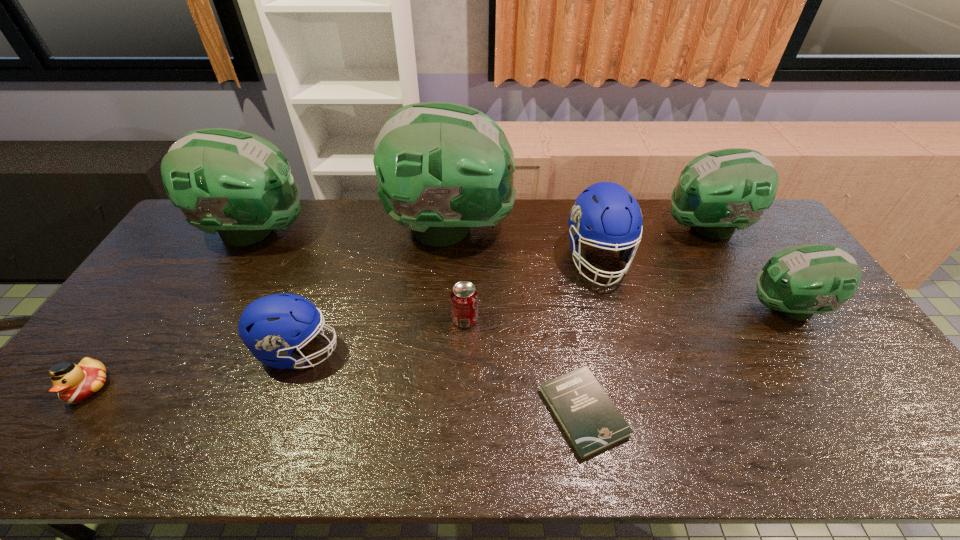
Identify the location of soda can. The image size is (960, 540). (464, 296).

Identify the location of red duck. This screenshot has width=960, height=540. (74, 383).

Where is `duck`? The height and width of the screenshot is (540, 960). duck is located at coordinates pyautogui.click(x=74, y=383).

Identify the location of the shortest object. This screenshot has height=540, width=960. (591, 421).

Where is `book`? This screenshot has width=960, height=540. book is located at coordinates (591, 421).

The width and height of the screenshot is (960, 540). In order to click on free space located on the visor of the second green football helmet from left to right in this screenshot , I will do `click(619, 229)`.

Where is `vacant space located on the visor of the second biggest green football helmet`? vacant space located on the visor of the second biggest green football helmet is located at coordinates (409, 231).

Identify the location of vacant space located 0.330m on the visor of the third biggest green football helmet. (570, 228).

Locate an element on the screen. This screenshot has width=960, height=540. free location located 0.190m on the visor of the third biggest green football helmet is located at coordinates (610, 228).

Locate an element on the screen. This screenshot has width=960, height=540. free space located on the visor of the third biggest green football helmet is located at coordinates (601, 228).